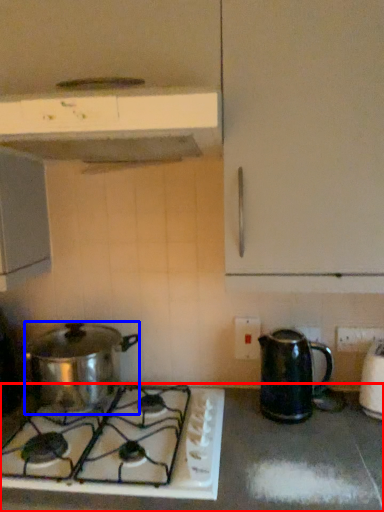
Question: Which object appears closest to the camera in this image, countertop (highlighted by a red box) or kitchen appliance (highlighted by a blue box)?

Choices:
 (A) countertop
 (B) kitchen appliance

Answer: (A)